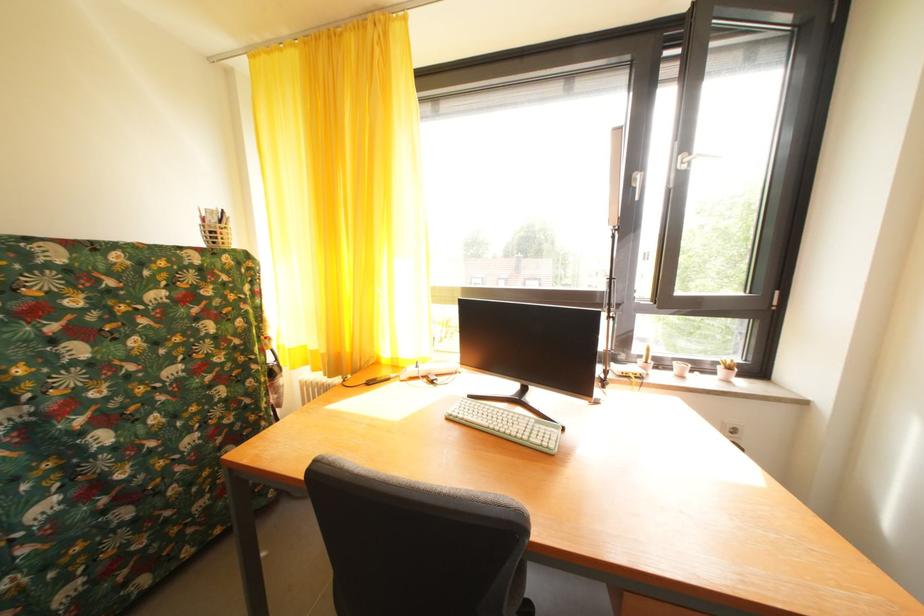
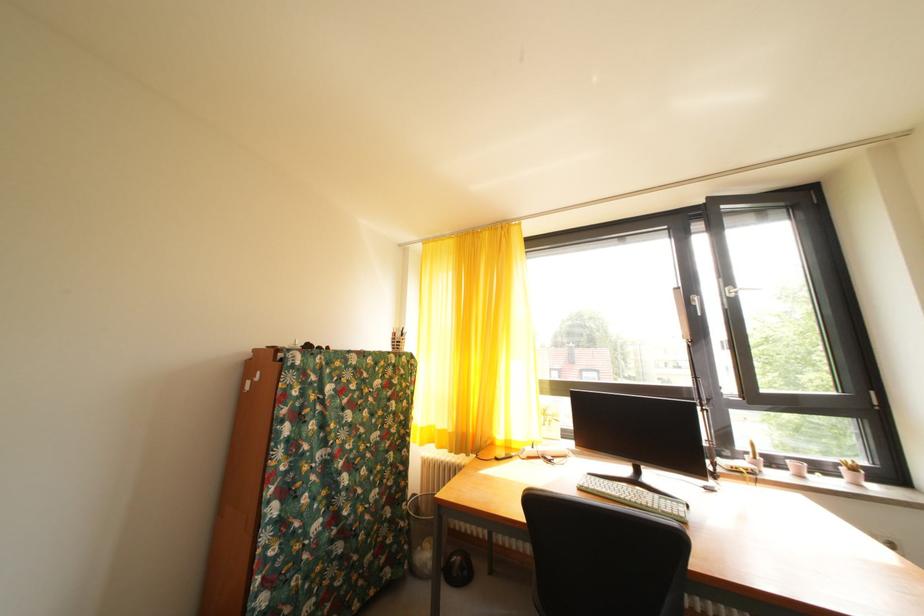
Question: How did the camera likely rotate?

Choices:
 (A) Left
 (B) Right
 (C) Up
 (D) Down

Answer: (C)